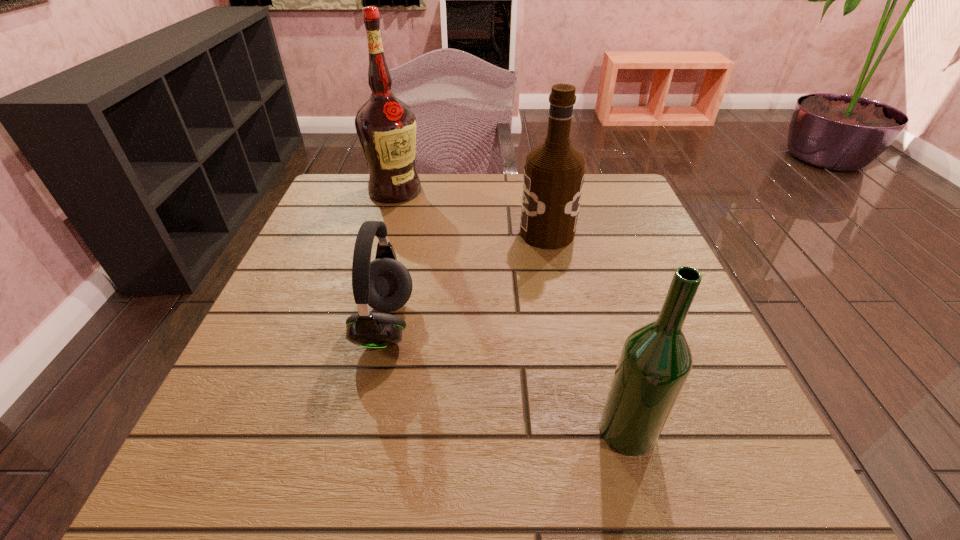
In the image, there is a desktop. Where is `free space at the far left corner`? Image resolution: width=960 pixels, height=540 pixels. free space at the far left corner is located at coordinates (355, 174).

Image resolution: width=960 pixels, height=540 pixels. In order to click on vacant position at the far right corner of the desktop in this screenshot , I will do `click(612, 191)`.

Where is `vacant area that lies between the nearest alcohol and the second nearest object`? The image size is (960, 540). vacant area that lies between the nearest alcohol and the second nearest object is located at coordinates (507, 377).

You are a GUI agent. You are given a task and a screenshot of the screen. Output one action in this format:
    pyautogui.click(x=<x>, y=<y>)
    Task: Click on the vacant space that is in between the second farthest object and the headset
    The image size is (960, 540).
    Given the screenshot: What is the action you would take?
    pyautogui.click(x=467, y=279)

This screenshot has height=540, width=960. I want to click on free space between the tallest object and the nearest object, so click(512, 310).

The image size is (960, 540). What are the coordinates of `empty space that is in between the second nearest alcohol and the nearest alcohol` in the screenshot? It's located at (588, 332).

This screenshot has height=540, width=960. What are the coordinates of `free space between the nearest alcohol and the third nearest object` in the screenshot? It's located at (588, 332).

I want to click on vacant region between the third nearest object and the shortest object, so click(x=467, y=279).

Locate an element on the screen. The image size is (960, 540). empty space that is in between the headset and the nearest alcohol is located at coordinates (507, 377).

The width and height of the screenshot is (960, 540). Identify the location of free space between the nearest alcohol and the shortest object. (507, 377).